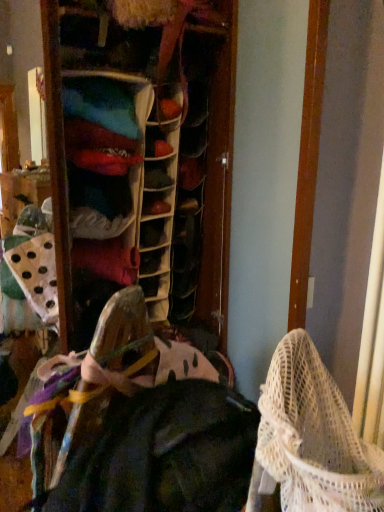
Question: Can you confirm if dark green fabric at center is positioned to the right of white mesh baby carriage at lower right?

Choices:
 (A) yes
 (B) no

Answer: (B)

Question: Is dark green fabric at center positioned behind white mesh baby carriage at lower right?

Choices:
 (A) no
 (B) yes

Answer: (B)

Question: Considering the relative sizes of dark green fabric at center and white mesh baby carriage at lower right in the image provided, is dark green fabric at center shorter than white mesh baby carriage at lower right?

Choices:
 (A) no
 (B) yes

Answer: (A)

Question: From a real-world perspective, is dark green fabric at center under white mesh baby carriage at lower right?

Choices:
 (A) no
 (B) yes

Answer: (B)

Question: Considering the relative sizes of dark green fabric at center and white mesh baby carriage at lower right in the image provided, is dark green fabric at center taller than white mesh baby carriage at lower right?

Choices:
 (A) yes
 (B) no

Answer: (A)

Question: Is dark green fabric at center positioned with its back to white mesh baby carriage at lower right?

Choices:
 (A) no
 (B) yes

Answer: (A)

Question: Can you confirm if white mesh baby carriage at lower right is positioned to the left of dark green fabric at center?

Choices:
 (A) no
 (B) yes

Answer: (A)

Question: From the image's perspective, is white mesh baby carriage at lower right on top of dark green fabric at center?

Choices:
 (A) no
 (B) yes

Answer: (B)

Question: Is white mesh baby carriage at lower right placed right next to dark green fabric at center?

Choices:
 (A) no
 (B) yes

Answer: (A)

Question: Is white mesh baby carriage at lower right further to the viewer compared to dark green fabric at center?

Choices:
 (A) yes
 (B) no

Answer: (B)

Question: Is white mesh baby carriage at lower right wider than dark green fabric at center?

Choices:
 (A) no
 (B) yes

Answer: (A)

Question: Can you confirm if white mesh baby carriage at lower right is bigger than dark green fabric at center?

Choices:
 (A) yes
 (B) no

Answer: (B)

Question: Is point (168, 437) positioned closer to the camera than point (269, 442)?

Choices:
 (A) closer
 (B) farther

Answer: (B)